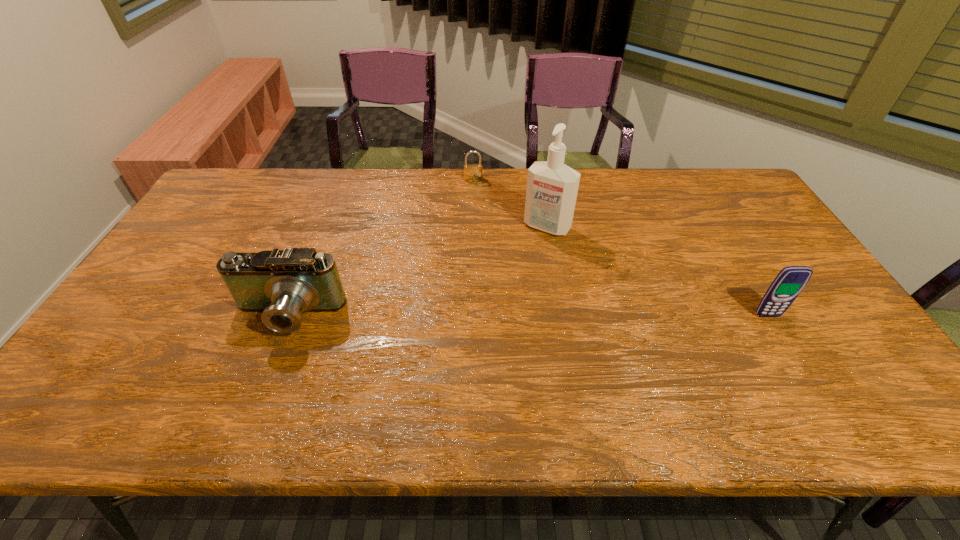
You are a GUI agent. You are given a task and a screenshot of the screen. Output one action in this format:
    pyautogui.click(x=<x>, y=<y>)
    Task: Click on the free space between the camcorder and the padlock
    This screenshot has height=540, width=960.
    Given the screenshot: What is the action you would take?
    pyautogui.click(x=380, y=248)

The image size is (960, 540). I want to click on vacant point located between the padlock and the leftmost object, so click(380, 248).

I want to click on vacant area that lies between the second object from left to right and the second farthest object, so click(x=510, y=203).

This screenshot has width=960, height=540. Find the location of `free spot between the camcorder and the rightmost object`. free spot between the camcorder and the rightmost object is located at coordinates (527, 316).

Image resolution: width=960 pixels, height=540 pixels. I want to click on blank region between the leftmost object and the padlock, so click(380, 248).

Identify the location of vacant space in between the leftmost object and the cellular telephone. (527, 316).

Locate an element on the screen. The width and height of the screenshot is (960, 540). empty space between the shortest object and the camcorder is located at coordinates (380, 248).

Locate an element on the screen. The width and height of the screenshot is (960, 540). free spot between the cellular telephone and the leftmost object is located at coordinates (527, 316).

This screenshot has height=540, width=960. What are the coordinates of `vacant space that is in between the cellular telephone and the second object from left to right` in the screenshot? It's located at (620, 247).

Image resolution: width=960 pixels, height=540 pixels. I want to click on unoccupied position between the tallest object and the shortest object, so click(x=510, y=203).